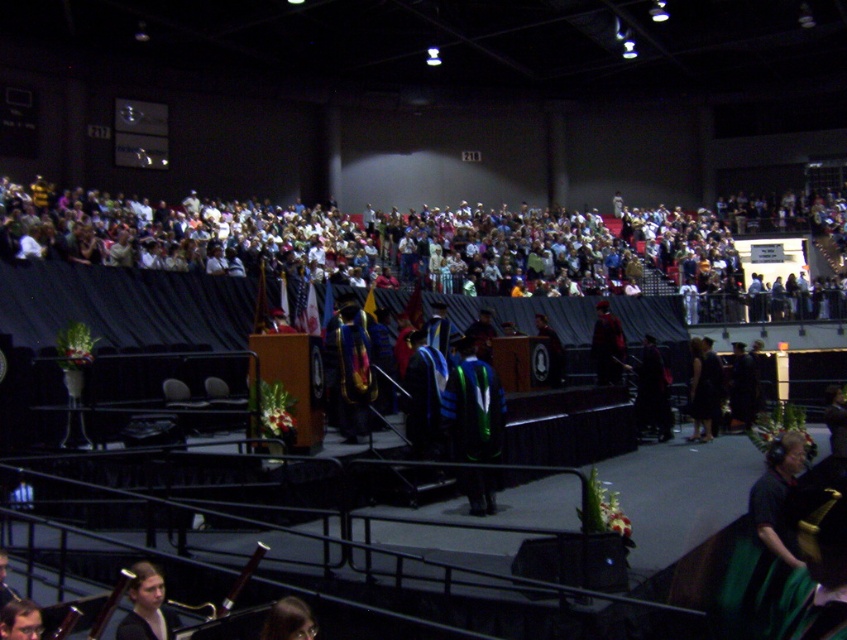
You are a photographer at the graduation ceremony. You want to capture a photo that includes both the multicolored fabric crowd at upper center and the smooth brown hair at lower left. Which object should you focus on first to ensure both are in frame?

You should focus on the multicolored fabric crowd at upper center first because it is larger in size than the smooth brown hair at lower left, making it easier to frame both objects in the photo.

You are a photographer at the graduation ceremony. You need to capture a photo of the smooth brown hair at lower left without the multicolored fabric crowd at upper center blocking the view. Is this possible based on their positions?

The multicolored fabric crowd at upper center is positioned over smooth brown hair at lower left, so the crowd is blocking the view of the smooth brown hair at lower left. Therefore, it is not possible to capture a clear photo of the smooth brown hair at lower left without the crowd blocking it.

You are a photographer at the graduation ceremony. You need to capture a photo that includes both the multicolored fabric crowd at upper center and the smooth brown hair at lower left. Which object should be placed on the left side of the photo to ensure both fit in the frame?

The smooth brown hair at lower left should be placed on the left side of the photo because it has a smaller width compared to the multicolored fabric crowd at upper center, allowing both to fit within the frame.